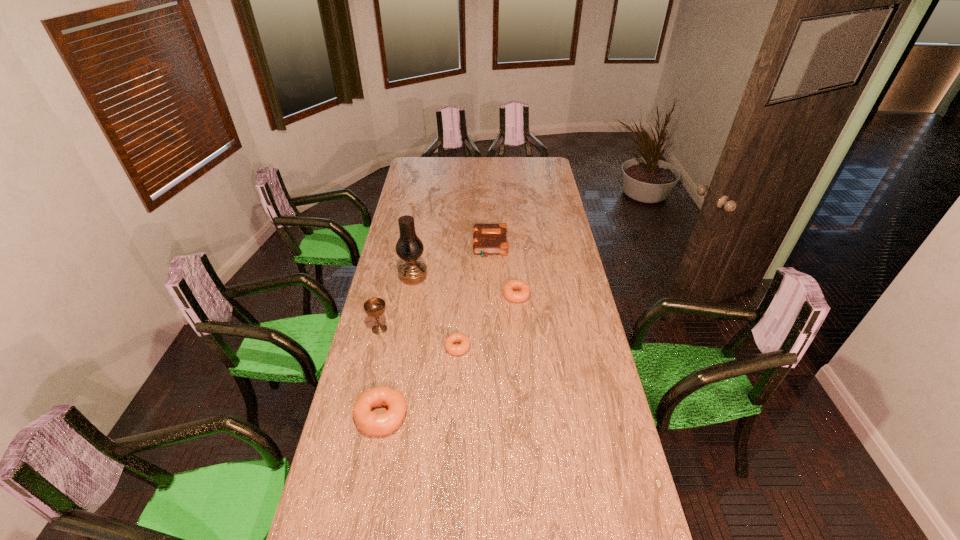
I want to click on oil lamp that is positioned at the left edge, so click(409, 247).

At what (x,y) coordinates should I click in order to perform the action: click on free space at the far edge of the desktop. Please return your answer as a coordinate pair (x, y). Looking at the image, I should click on (518, 170).

The width and height of the screenshot is (960, 540). What are the coordinates of `blank space at the left edge` in the screenshot? It's located at (426, 186).

Identify the location of free space at the right edge of the desktop. (583, 290).

This screenshot has width=960, height=540. I want to click on free spot between the chalice and the shortest doughnut, so click(419, 338).

Image resolution: width=960 pixels, height=540 pixels. What are the coordinates of `vacant point located between the leftmost doughnut and the second tallest object` in the screenshot? It's located at (380, 372).

Locate an element on the screen. empty space that is in between the fifth shortest object and the second doughnut from right to left is located at coordinates (419, 338).

The height and width of the screenshot is (540, 960). In order to click on unoccupied position between the second farthest doughnut and the chalice in this screenshot , I will do `click(419, 338)`.

In order to click on vacant area between the second farthest doughnut and the chalice in this screenshot , I will do `click(419, 338)`.

The image size is (960, 540). I want to click on vacant point located between the farthest doughnut and the farthest object, so click(503, 270).